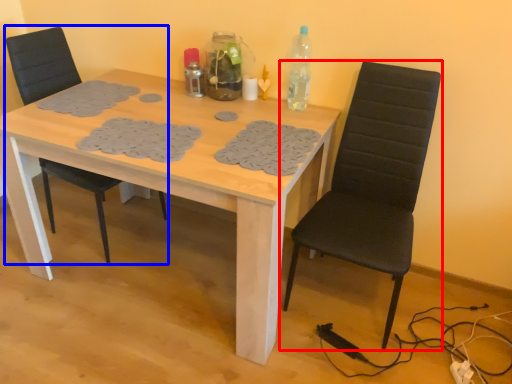
Question: Which object appears farthest to the camera in this image, chair (highlighted by a red box) or chair (highlighted by a blue box)?

Choices:
 (A) chair
 (B) chair

Answer: (B)